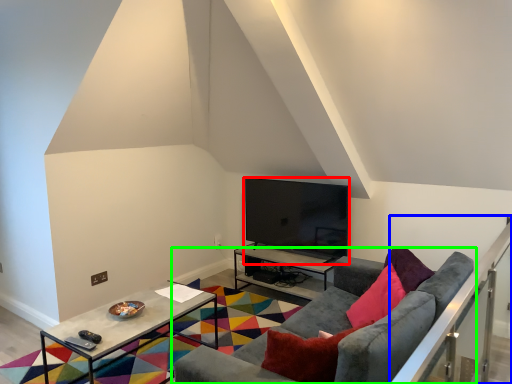
Question: Which object is the farthest from television (highlighted by a red box)? Choose among these: balustrade (highlighted by a blue box) or studio couch (highlighted by a green box).

Choices:
 (A) balustrade
 (B) studio couch

Answer: (A)